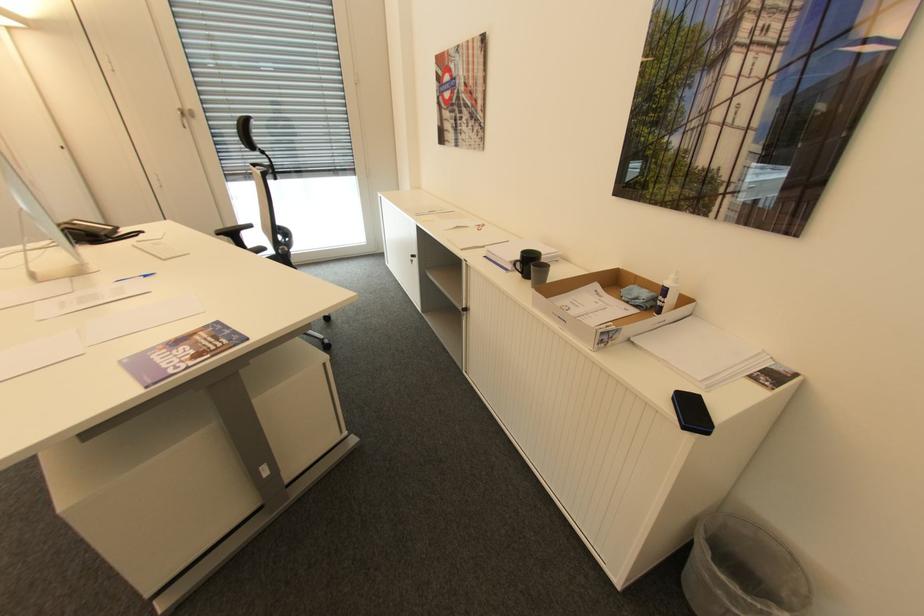
In order to click on black mug in this screenshot , I will do `click(526, 262)`.